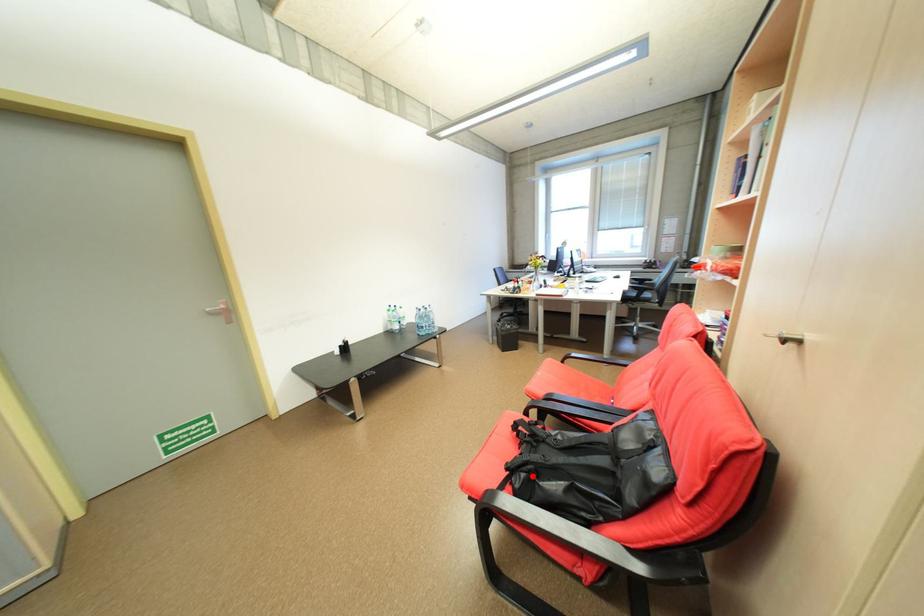
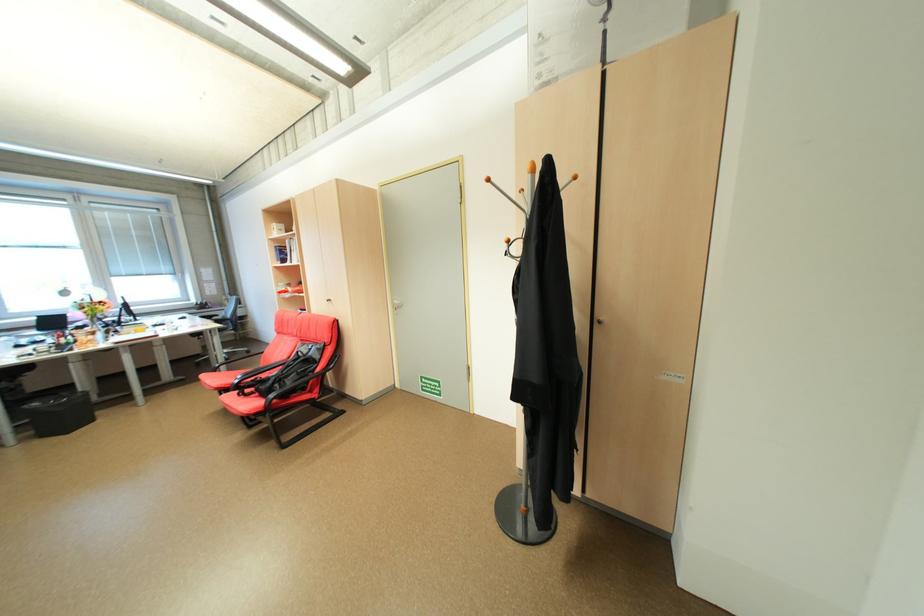
Where in the second image is the point corresponding to the highlighted location from the first image?

(286, 386)